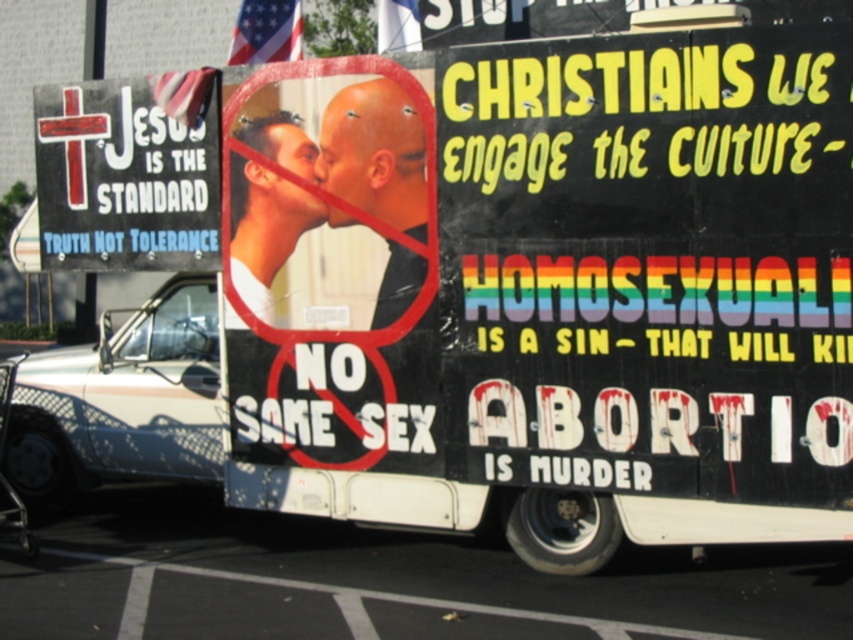
Which is more to the right, smooth skin face at center or matte white shirt at center?

From the viewer's perspective, smooth skin face at center appears more on the right side.

Which is below, smooth skin face at center or matte white shirt at center?

Positioned lower is matte white shirt at center.

Find the location of a particular element. Image resolution: width=853 pixels, height=640 pixels. smooth skin face at center is located at coordinates (376, 154).

Which of these two, black painted signboard at center right or matte white shirt at center, stands taller?

black painted signboard at center right is taller.

Is black painted signboard at center right positioned in front of matte white shirt at center?

Yes.

What do you see at coordinates (650, 262) in the screenshot? I see `black painted signboard at center right` at bounding box center [650, 262].

This screenshot has height=640, width=853. What are the coordinates of `black painted signboard at center right` in the screenshot? It's located at (650, 262).

Which is more to the right, black painted signboard at center right or smooth skin face at center?

From the viewer's perspective, black painted signboard at center right appears more on the right side.

Between black painted signboard at center right and smooth skin face at center, which one is positioned higher?

smooth skin face at center

Is point (641, 269) less distant than point (358, 120)?

That is True.

This screenshot has height=640, width=853. Find the location of `black painted signboard at center right`. black painted signboard at center right is located at coordinates (650, 262).